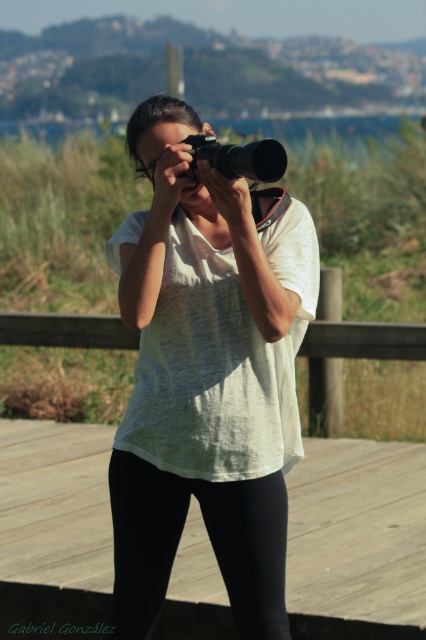
Is white matte shirt at center wider than matte black camera at center?

Yes, white matte shirt at center is wider than matte black camera at center.

Find the location of a particular element. This screenshot has width=426, height=640. white matte shirt at center is located at coordinates (207, 376).

Does black leggings at lower center have a smaller size compared to matte black camera at center?

Yes.

Is point (233, 532) behind point (256, 173)?

Yes, it is behind point (256, 173).

What do you see at coordinates (210, 540) in the screenshot? The width and height of the screenshot is (426, 640). I see `black leggings at lower center` at bounding box center [210, 540].

This screenshot has height=640, width=426. Find the location of `black leggings at lower center`. black leggings at lower center is located at coordinates (210, 540).

Which is below, wooden at center or black leggings at lower center?

wooden at center is below.

Does point (308, 580) come behind point (180, 516)?

Yes, point (308, 580) is behind point (180, 516).

Does point (51, 552) lie behind point (143, 624)?

Yes, it is.

Find the location of `wooden at center`. wooden at center is located at coordinates (356, 540).